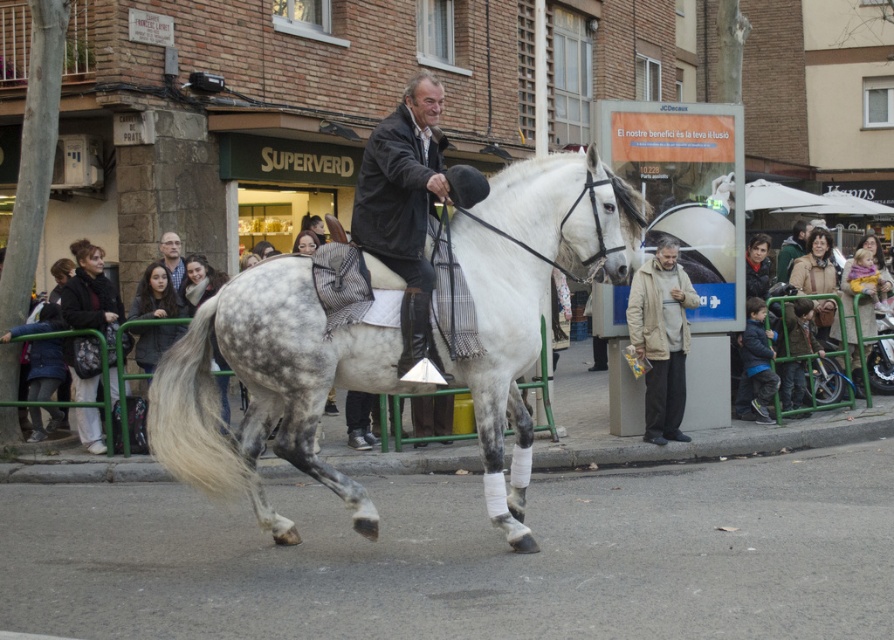
Question: Does dark gray scarf at left come in front of dark blue jacket at lower right?

Choices:
 (A) no
 (B) yes

Answer: (B)

Question: Can you confirm if beige fabric jacket at right is bigger than dark blue jacket at lower right?

Choices:
 (A) no
 (B) yes

Answer: (B)

Question: Can you confirm if speckled white horse at center is bigger than dark brown leather jacket at center?

Choices:
 (A) yes
 (B) no

Answer: (A)

Question: Estimate the real-world distances between objects in this image. Which object is closer to the dark brown leather jacket at center?

Choices:
 (A) dark blue jacket at lower right
 (B) speckled white horse at center

Answer: (B)

Question: Which object is closer to the camera taking this photo?

Choices:
 (A) dark gray scarf at left
 (B) speckled white horse at center
 (C) dark blue jacket at lower right

Answer: (B)

Question: Which of these objects is positioned closest to the dark brown leather jacket at center?

Choices:
 (A) dark blue jacket at lower right
 (B) dark gray scarf at left

Answer: (B)